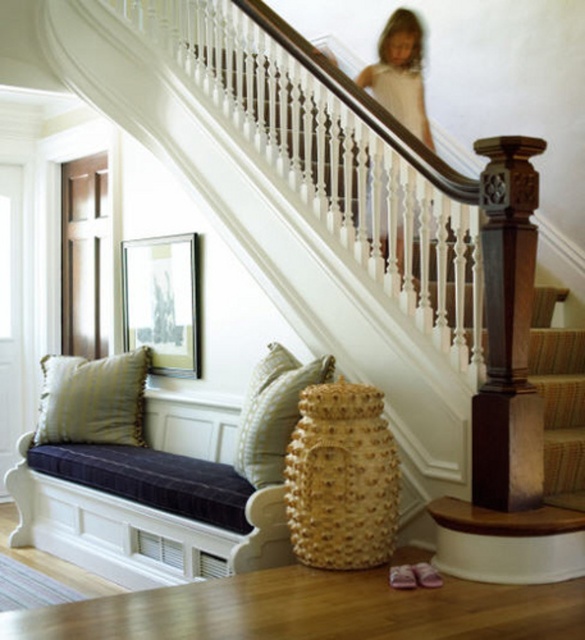
Question: Which point appears closest to the camera in this image?

Choices:
 (A) (280, 449)
 (B) (517, 452)
 (C) (246, 516)
 (D) (397, 227)

Answer: (B)

Question: In this image, where is textured beige pillow at center located relative to white lace dress at upper center?

Choices:
 (A) left
 (B) right

Answer: (A)

Question: Which point appears closest to the camera in this image?

Choices:
 (A) (47, 376)
 (B) (397, 109)
 (C) (119, 502)
 (D) (271, 358)

Answer: (D)

Question: Can you confirm if velvet blue bench at lower left is positioned below textured beige pillow at center?

Choices:
 (A) no
 (B) yes

Answer: (B)

Question: Which of the following is the farthest from the observer?

Choices:
 (A) (517, 360)
 (B) (207, 550)
 (C) (402, 90)
 (D) (270, 397)

Answer: (C)

Question: Can you confirm if dark wood post at center is smaller than white lace dress at upper center?

Choices:
 (A) no
 (B) yes

Answer: (B)